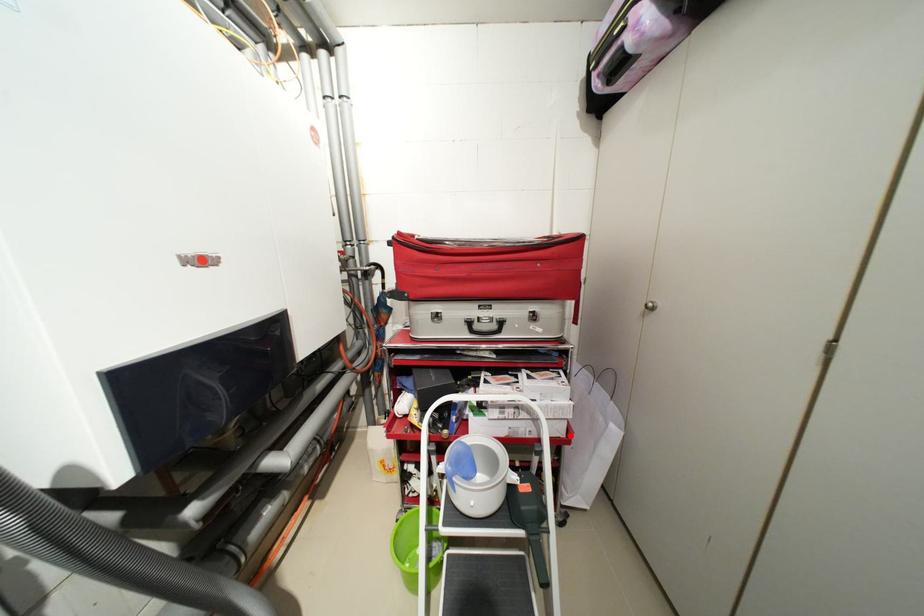
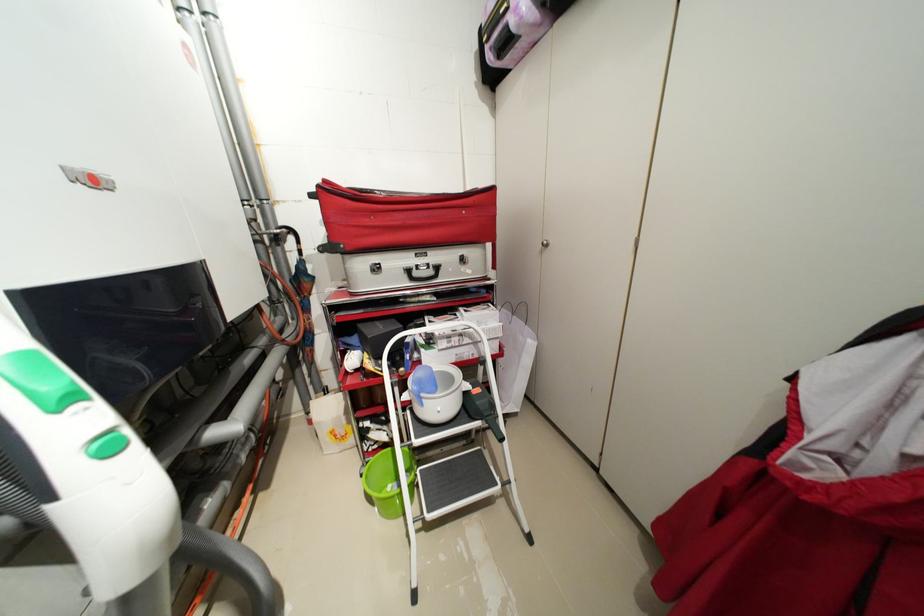
Question: I am providing you with two images of the same scene from different viewpoints. Image1 has a red point marked. In image2, the corresponding 3D location appears at what relative position? Reply with the corresponding letter.

Choices:
 (A) Closer
 (B) Farther

Answer: (A)